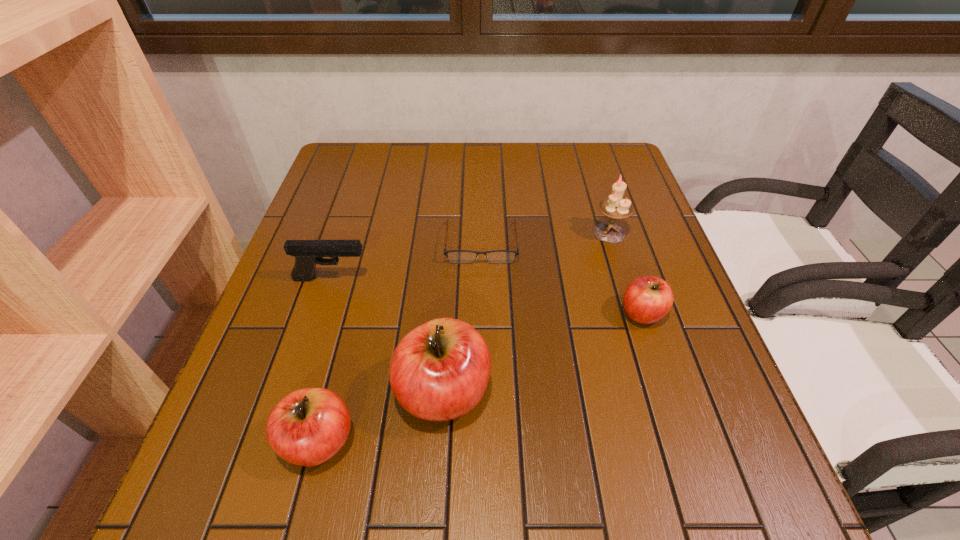
To make them evenly spaced by inserting another apple among them, please locate a vacant spot for this new apple. Please provide its 2D coordinates. Your answer should be formatted as a tuple, i.e. [(x, y)], where the tuple contains the x and y coordinates of a point satisfying the conditions above.

[(550, 350)]